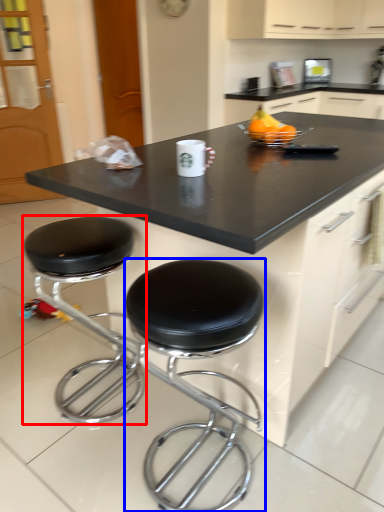
Question: Which point is further to the camera, stool (highlighted by a red box) or stool (highlighted by a blue box)?

Choices:
 (A) stool
 (B) stool

Answer: (A)